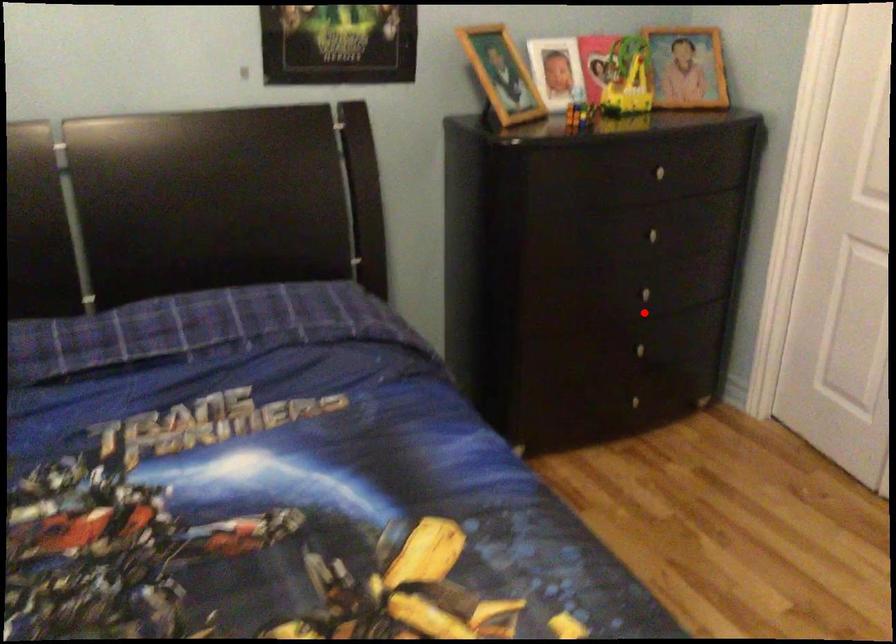
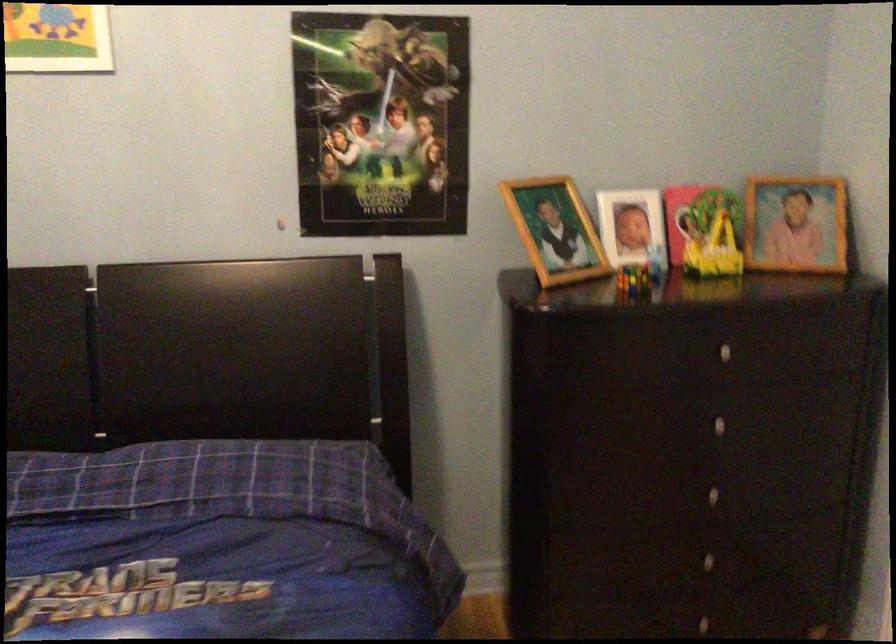
Where in the second image is the point corresponding to the highlighted location from the first image?

(711, 516)